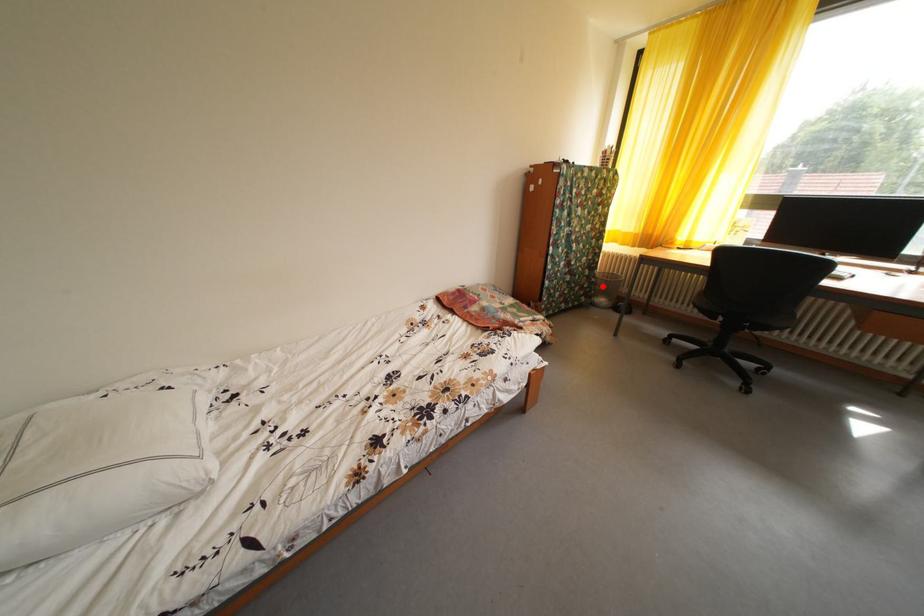
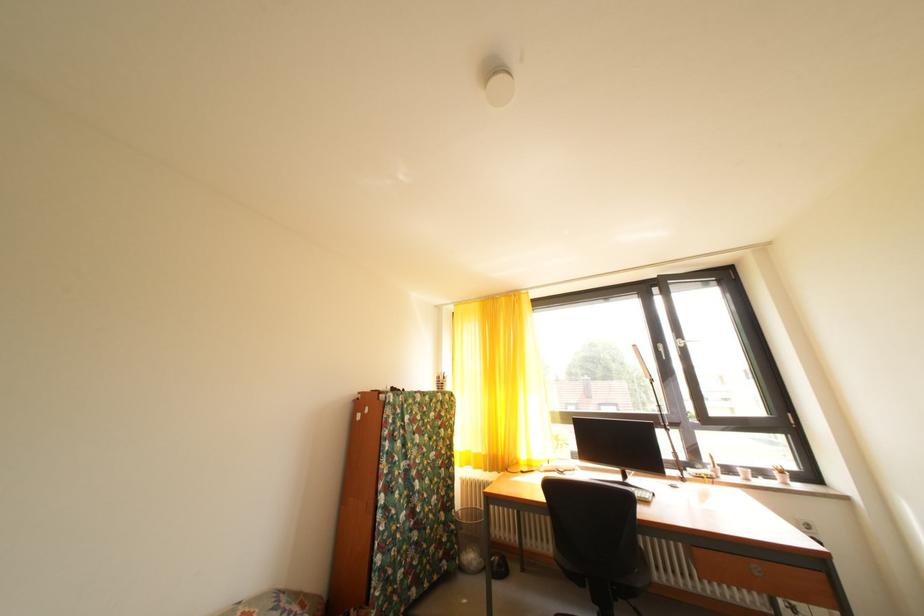
The point at the highlighted location is marked in the first image. Where is the corresponding point in the second image?

(462, 533)